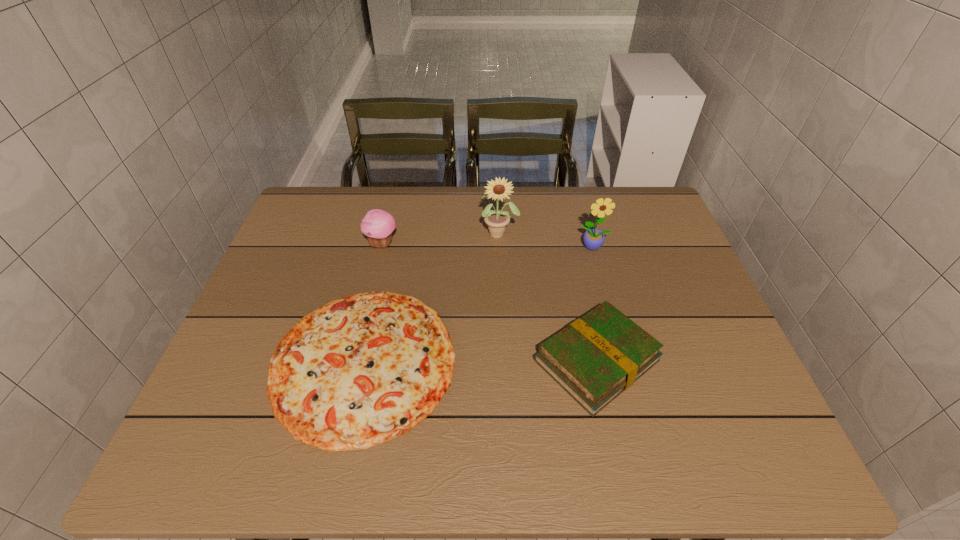
Where is `vacant space at the far left corner of the desktop`? The width and height of the screenshot is (960, 540). vacant space at the far left corner of the desktop is located at coordinates (327, 194).

Locate an element on the screen. The width and height of the screenshot is (960, 540). free space at the far right corner of the desktop is located at coordinates (659, 215).

Locate an element on the screen. Image resolution: width=960 pixels, height=540 pixels. vacant space that is in between the pizza and the third object from left to right is located at coordinates (432, 298).

Locate an element on the screen. free space between the second tallest object and the second shortest object is located at coordinates (595, 303).

Where is `vacant space in between the pizza and the second tallest object`? The height and width of the screenshot is (540, 960). vacant space in between the pizza and the second tallest object is located at coordinates (479, 305).

What are the coordinates of `free space between the third tallest object and the book` in the screenshot? It's located at (490, 302).

The height and width of the screenshot is (540, 960). I want to click on empty location between the right sunflower and the fourth tallest object, so click(x=595, y=303).

You are a GUI agent. You are given a task and a screenshot of the screen. Output one action in this format:
    pyautogui.click(x=<x>, y=<y>)
    Task: Click on the vacant space that is in between the book and the tallest object
    
    Given the screenshot: What is the action you would take?
    pyautogui.click(x=548, y=297)

The image size is (960, 540). Find the location of `empty space between the cupcake and the book`. empty space between the cupcake and the book is located at coordinates (490, 302).

Find the location of a particular element. The width and height of the screenshot is (960, 540). free space between the right sunflower and the book is located at coordinates (595, 303).